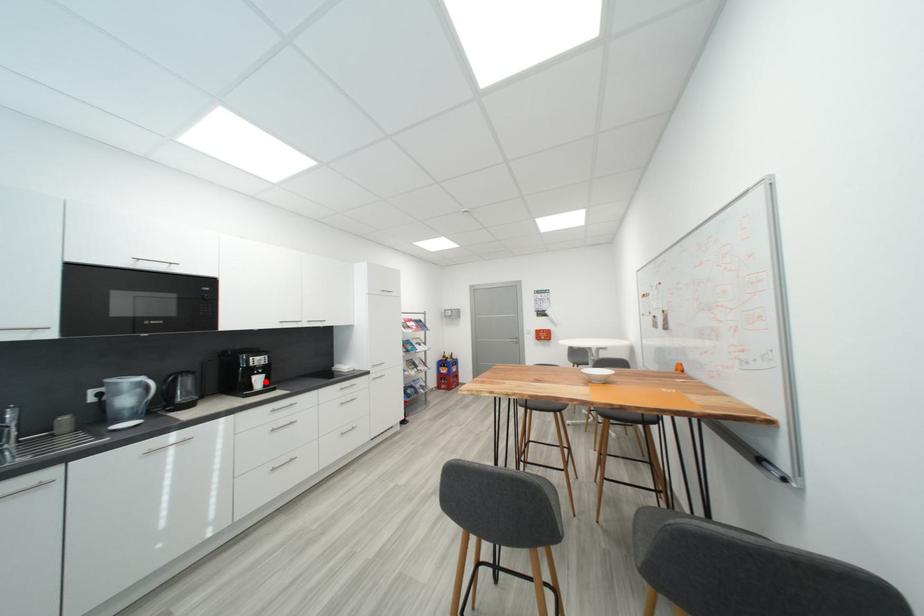
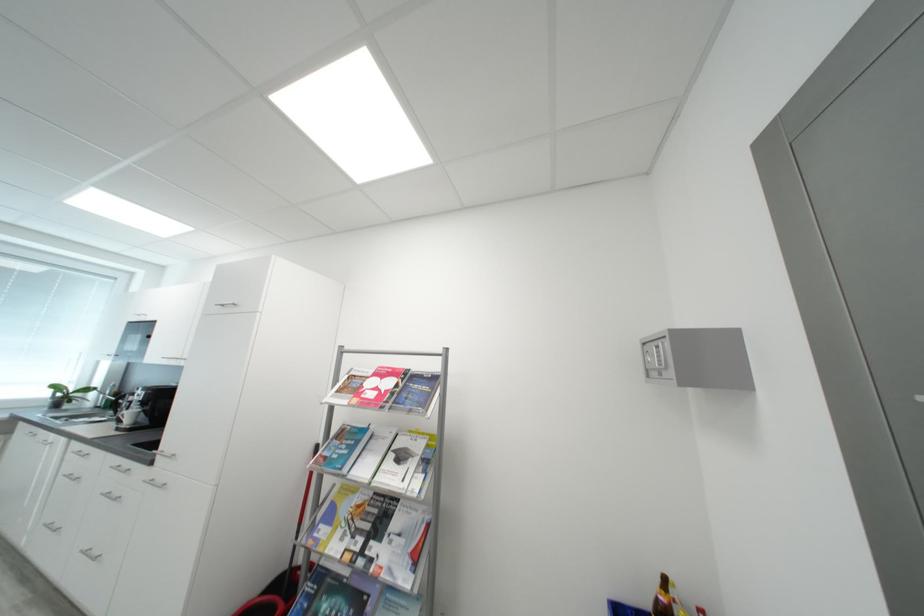
Question: I am providing you with two images of the same scene from different viewpoints. A red point is shown in image1. For the corresponding object point in image2, is it positioned nearer or farther from the camera?

Choices:
 (A) Nearer
 (B) Farther

Answer: (A)